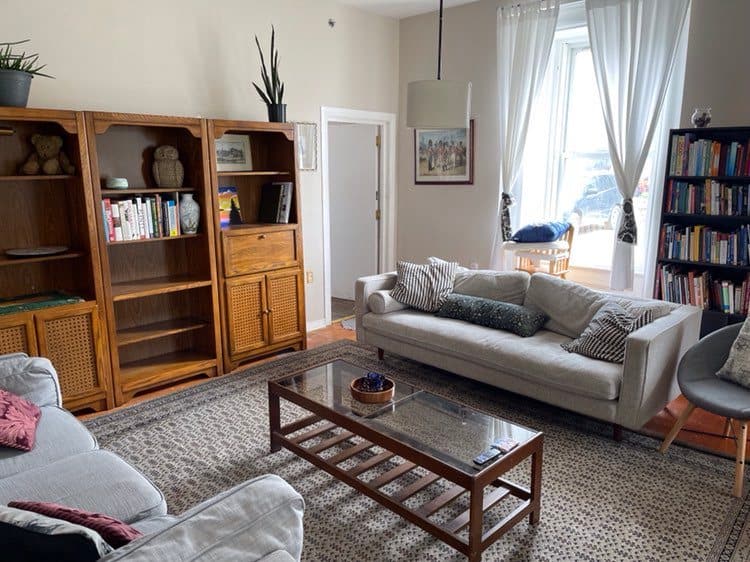
Locate an element on the screen. This screenshot has width=750, height=562. remote is located at coordinates (483, 455).